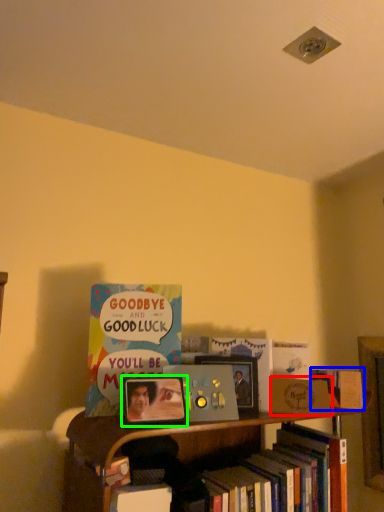
Question: Which object is positioned farthest from paperback book (highlighted by a red box)? Select from book (highlighted by a blue box) and picture frame (highlighted by a green box).

Choices:
 (A) book
 (B) picture frame

Answer: (B)